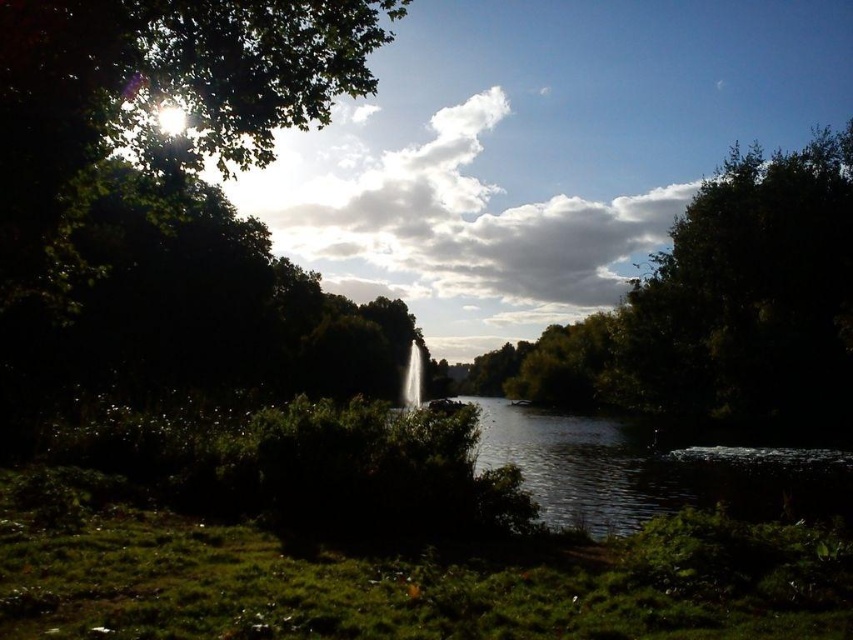
Question: Which object is the closest to the white fluffy cloud at upper center?

Choices:
 (A) dark reflective water at center
 (B) green leafy tree at upper right

Answer: (B)

Question: Can you confirm if green leafy tree at upper right is wider than white fluffy cloud at upper center?

Choices:
 (A) no
 (B) yes

Answer: (A)

Question: Among these objects, which one is nearest to the camera?

Choices:
 (A) white fluffy cloud at upper center
 (B) green leafy tree at upper right

Answer: (B)

Question: Which point appears farthest from the camera in this image?

Choices:
 (A) pos(317,228)
 (B) pos(828,269)
 (C) pos(577,486)

Answer: (A)

Question: Can you confirm if white fluffy cloud at upper center is bigger than dark reflective water at center?

Choices:
 (A) no
 (B) yes

Answer: (B)

Question: Is green leafy tree at upper right positioned behind white fluffy cloud at upper center?

Choices:
 (A) no
 (B) yes

Answer: (A)